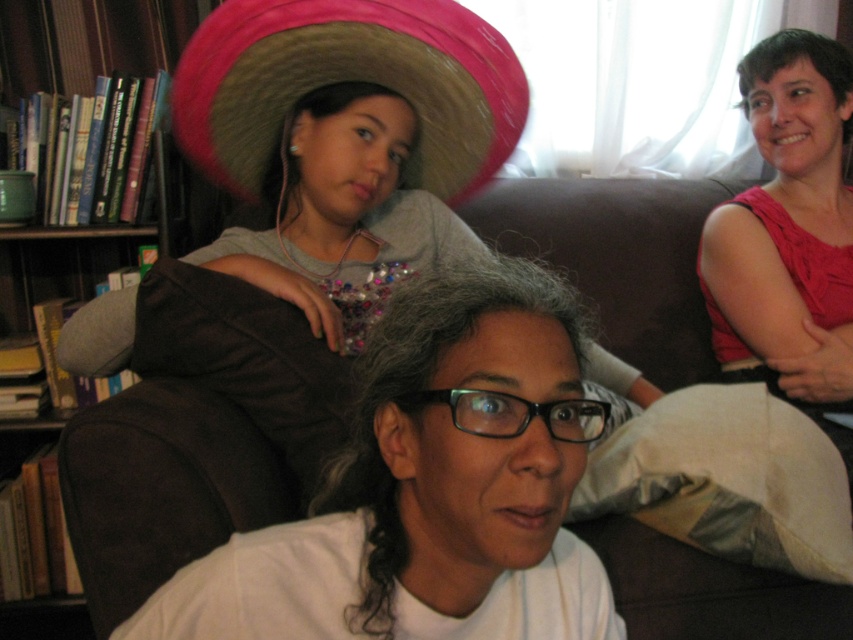
You are standing in the room and see two points marked in the image. The first point is at coordinates point [235,481] and the second is at point [155,20]. Which point is closer to you?

Point [235,481] is in front of point [155,20], so it is closer to you.

You are a photographer trying to capture a group photo of the people on the couch. You notice the pink fabric top at upper right and the wooden bookshelf at left. Which object should you adjust to ensure both are fully visible in the frame?

The pink fabric top at upper right is taller than the wooden bookshelf at left, so you should adjust the angle or position to ensure the taller pink fabric top at upper right is fully visible, which would likely include the bookshelf as well.